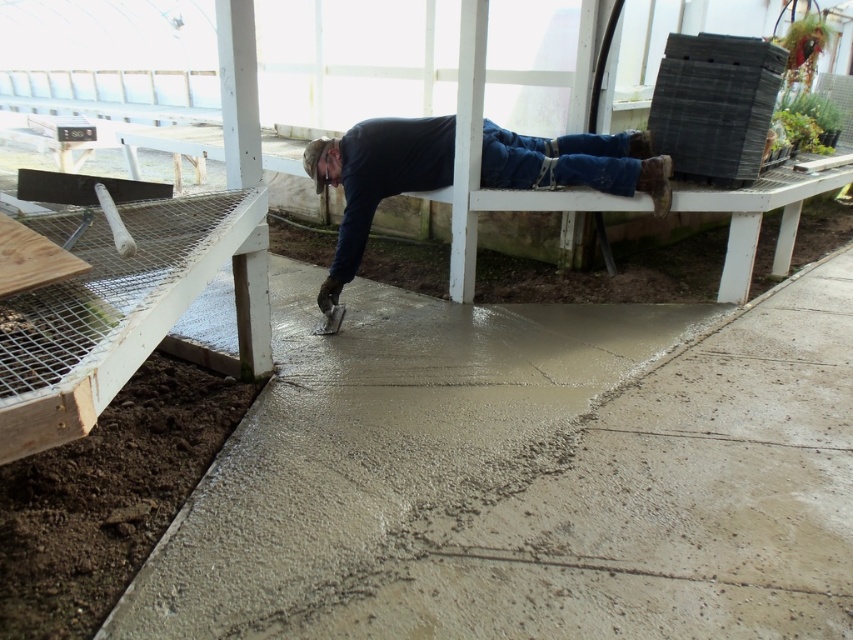
Does brown soil at lower left have a smaller size compared to blue denim jeans at upper center?

Yes, brown soil at lower left is smaller than blue denim jeans at upper center.

Can you confirm if brown soil at lower left is positioned above blue denim jeans at upper center?

Actually, brown soil at lower left is below blue denim jeans at upper center.

This screenshot has height=640, width=853. I want to click on brown soil at lower left, so click(x=107, y=497).

Can you confirm if smooth concrete at center is taller than blue denim jeans at upper center?

In fact, smooth concrete at center may be shorter than blue denim jeans at upper center.

Is smooth concrete at center further to camera compared to blue denim jeans at upper center?

No.

What do you see at coordinates (527, 476) in the screenshot? This screenshot has height=640, width=853. I see `smooth concrete at center` at bounding box center [527, 476].

The width and height of the screenshot is (853, 640). In order to click on smooth concrete at center in this screenshot , I will do `click(527, 476)`.

Does smooth concrete at center have a smaller size compared to brown soil at lower left?

No, smooth concrete at center is not smaller than brown soil at lower left.

This screenshot has height=640, width=853. In order to click on smooth concrete at center in this screenshot , I will do click(527, 476).